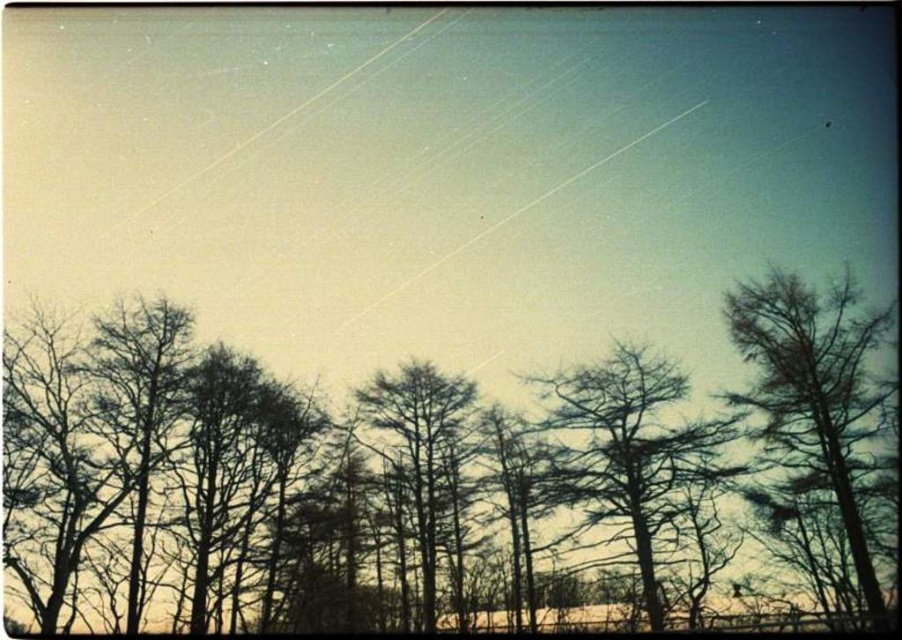
Question: Which point appears closest to the camera in this image?

Choices:
 (A) (422, 385)
 (B) (758, 337)

Answer: (B)

Question: Which is farther from the green matte tree at center?

Choices:
 (A) brown matte trees at center
 (B) brown textured tree at center
 (C) green leafy tree at upper right

Answer: (C)

Question: Can you confirm if brown matte trees at center is positioned to the right of green matte tree at center?

Choices:
 (A) yes
 (B) no

Answer: (A)

Question: Which object is the closest to the green leafy tree at upper right?

Choices:
 (A) green matte tree at center
 (B) brown matte trees at center

Answer: (B)

Question: Can you confirm if brown matte trees at center is wider than green leafy tree at upper right?

Choices:
 (A) yes
 (B) no

Answer: (A)

Question: In this image, where is brown matte trees at center located relative to green leafy tree at upper right?

Choices:
 (A) above
 (B) below

Answer: (B)